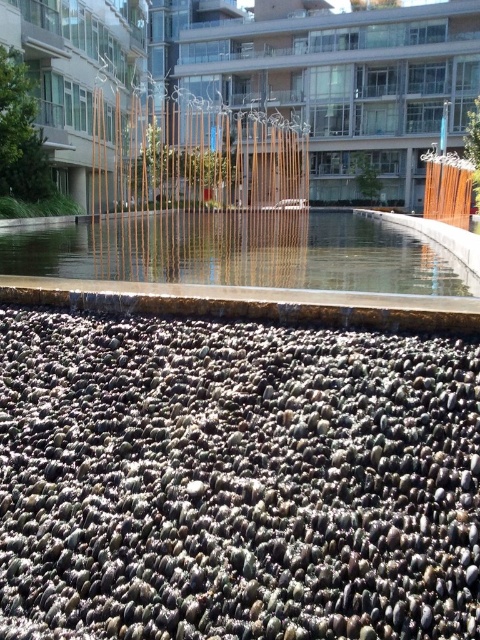
Which of these two, black pebbles at bottom or clear glass water at center, stands shorter?

Standing shorter between the two is black pebbles at bottom.

Can you confirm if black pebbles at bottom is positioned below clear glass water at center?

Yes.

What do you see at coordinates (236, 481) in the screenshot? I see `black pebbles at bottom` at bounding box center [236, 481].

The width and height of the screenshot is (480, 640). What are the coordinates of `black pebbles at bottom` in the screenshot? It's located at (236, 481).

Does brown wooden fence at upper center have a lesser width compared to clear glass water at center?

No.

The width and height of the screenshot is (480, 640). Describe the element at coordinates (227, 244) in the screenshot. I see `brown wooden fence at upper center` at that location.

In order to click on brown wooden fence at upper center in this screenshot , I will do `click(227, 244)`.

Does black pebbles at bottom have a lesser height compared to brown wooden fence at upper center?

Indeed, black pebbles at bottom has a lesser height compared to brown wooden fence at upper center.

Is point (425, 397) positioned after point (223, 284)?

No, it is in front of (223, 284).

I want to click on black pebbles at bottom, so click(236, 481).